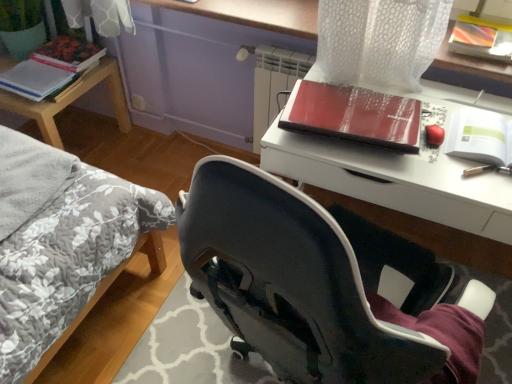
Question: Is green matte paperback book at upper right, the 3th paperback book positioned from the back, behind woodenmaterial/texturetable at left?

Choices:
 (A) no
 (B) yes

Answer: (A)

Question: Is green matte paperback book at upper right, the first paperback book from the bottom, directly adjacent to woodenmaterial/texturetable at left?

Choices:
 (A) yes
 (B) no

Answer: (B)

Question: Is green matte paperback book at upper right, positioned as the third paperback book in top-to-bottom order, not within woodenmaterial/texturetable at left?

Choices:
 (A) no
 (B) yes

Answer: (B)

Question: Could you tell me if green matte paperback book at upper right, which ranks as the third paperback book in left-to-right order, is facing woodenmaterial/texturetable at left?

Choices:
 (A) yes
 (B) no

Answer: (B)

Question: From the image's perspective, is green matte paperback book at upper right, positioned as the third paperback book in top-to-bottom order, on top of woodenmaterial/texturetable at left?

Choices:
 (A) no
 (B) yes

Answer: (A)

Question: Considering the relative positions of green matte paperback book at upper right, which ranks as the third paperback book in left-to-right order, and woodenmaterial/texturetable at left in the image provided, is green matte paperback book at upper right, which ranks as the third paperback book in left-to-right order, to the left of woodenmaterial/texturetable at left from the viewer's perspective?

Choices:
 (A) yes
 (B) no

Answer: (B)

Question: Is green matte paperback book at upper right, which ranks as the third paperback book in left-to-right order, completely or partially outside of matte hardcover book at upper left, the 2th paperback book when ordered from left to right?

Choices:
 (A) yes
 (B) no

Answer: (A)

Question: Is green matte paperback book at upper right, the first paperback book from the right, looking in the opposite direction of matte hardcover book at upper left, which is counted as the 2th paperback book, starting from the right?

Choices:
 (A) no
 (B) yes

Answer: (A)

Question: From a real-world perspective, is green matte paperback book at upper right, acting as the first paperback book starting from the front, physically below matte hardcover book at upper left, which is counted as the 2th paperback book, starting from the right?

Choices:
 (A) no
 (B) yes

Answer: (A)

Question: Can you confirm if green matte paperback book at upper right, positioned as the third paperback book in top-to-bottom order, is thinner than matte hardcover book at upper left, the 1th paperback book from the back?

Choices:
 (A) no
 (B) yes

Answer: (B)

Question: From the image's perspective, is green matte paperback book at upper right, positioned as the third paperback book in top-to-bottom order, beneath matte hardcover book at upper left, which is counted as the 2th paperback book, starting from the right?

Choices:
 (A) yes
 (B) no

Answer: (A)

Question: Considering the relative positions of green matte paperback book at upper right, the 3th paperback book positioned from the back, and matte hardcover book at upper left, acting as the third paperback book starting from the bottom, in the image provided, is green matte paperback book at upper right, the 3th paperback book positioned from the back, to the right of matte hardcover book at upper left, acting as the third paperback book starting from the bottom, from the viewer's perspective?

Choices:
 (A) yes
 (B) no

Answer: (A)

Question: Is matte paper notebook at left, the first paperback book from the left, at the right side of woodenmaterial/texturetable at left?

Choices:
 (A) yes
 (B) no

Answer: (A)